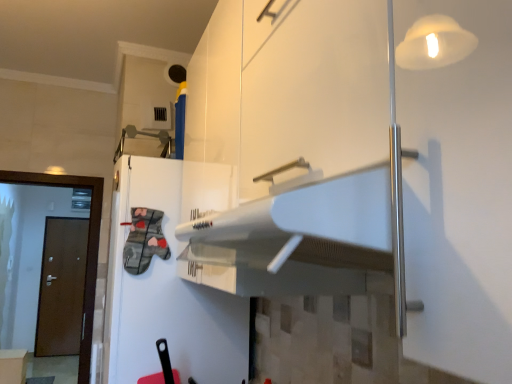
Question: Is brown wooden door at left, the 2th door from the right, shorter than brown wooden door at left, the 1th door viewed from the front?

Choices:
 (A) yes
 (B) no

Answer: (B)

Question: From a real-world perspective, is brown wooden door at left, the 1th door when ordered from left to right, located beneath brown wooden door at left, the 1th door viewed from the right?

Choices:
 (A) no
 (B) yes

Answer: (B)

Question: Would you say brown wooden door at left, placed as the first door when sorted from back to front, is outside brown wooden door at left, the 1th door viewed from the right?

Choices:
 (A) no
 (B) yes

Answer: (B)

Question: Does brown wooden door at left, which is counted as the second door, starting from the front, come in front of brown wooden door at left, the second door when ordered from back to front?

Choices:
 (A) no
 (B) yes

Answer: (A)

Question: Does brown wooden door at left, the 2th door from the right, have a lesser width compared to brown wooden door at left, the second door when ordered from back to front?

Choices:
 (A) no
 (B) yes

Answer: (B)

Question: Is point (148, 327) closer or farther from the camera than point (49, 256)?

Choices:
 (A) farther
 (B) closer

Answer: (B)

Question: Is white glossy refrigerator at center to the left or to the right of brown wooden door at left, the 2th door from the right, in the image?

Choices:
 (A) right
 (B) left

Answer: (A)

Question: From the image's perspective, relative to brown wooden door at left, which is counted as the second door, starting from the front, is white glossy refrigerator at center above or below?

Choices:
 (A) above
 (B) below

Answer: (A)

Question: Relative to brown wooden door at left, the 2th door from the right, is white glossy refrigerator at center in front or behind?

Choices:
 (A) front
 (B) behind

Answer: (A)

Question: In the image, is white glossy cabinet at lower left, which appears as the first cabinetry when viewed from the left, positioned in front of or behind brown wooden door at left, the 1th door viewed from the right?

Choices:
 (A) front
 (B) behind

Answer: (B)

Question: Is white glossy cabinet at lower left, positioned as the first cabinetry in back-to-front order, wider or thinner than brown wooden door at left, the 1th door viewed from the front?

Choices:
 (A) wide
 (B) thin

Answer: (A)

Question: In the image, is white glossy cabinet at lower left, positioned as the first cabinetry in back-to-front order, on the left side or the right side of brown wooden door at left, the 1th door viewed from the right?

Choices:
 (A) right
 (B) left

Answer: (B)

Question: In terms of size, does white glossy cabinet at lower left, the second cabinetry when ordered from front to back, appear bigger or smaller than brown wooden door at left, the 1th door viewed from the front?

Choices:
 (A) big
 (B) small

Answer: (B)

Question: Considering the positions of white glossy refrigerator at center and brown wooden door at left, the second door when ordered from back to front, in the image, is white glossy refrigerator at center wider or thinner than brown wooden door at left, the second door when ordered from back to front,?

Choices:
 (A) wide
 (B) thin

Answer: (A)

Question: From the image's perspective, is white glossy refrigerator at center located above or below brown wooden door at left, the 1th door viewed from the front?

Choices:
 (A) below
 (B) above

Answer: (B)